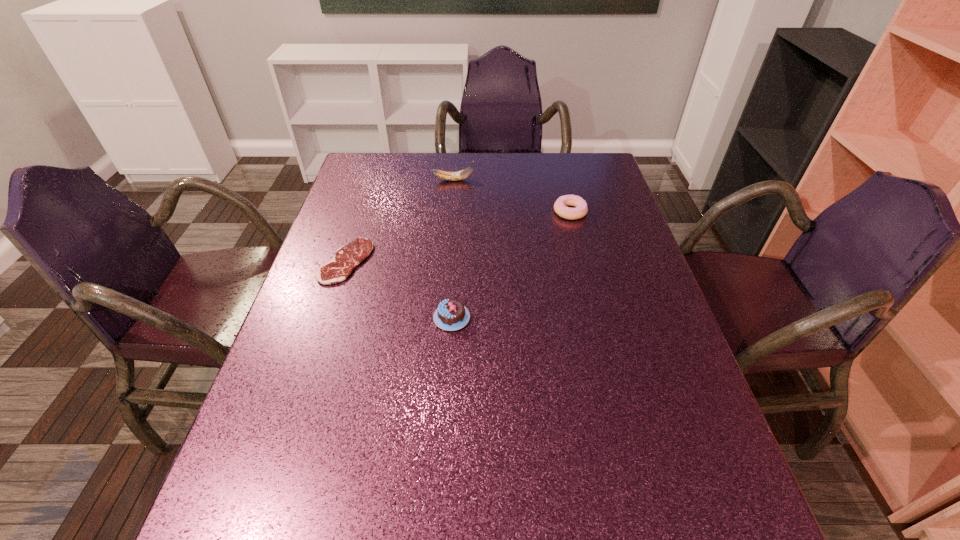
Where is `the tallest object`? the tallest object is located at coordinates (459, 175).

Locate an element on the screen. The height and width of the screenshot is (540, 960). banana is located at coordinates (459, 175).

This screenshot has width=960, height=540. I want to click on the nearest object, so click(451, 314).

Where is `the third nearest object`? This screenshot has width=960, height=540. the third nearest object is located at coordinates (560, 208).

Locate an element on the screen. The width and height of the screenshot is (960, 540). the third tallest object is located at coordinates (560, 208).

Find the location of a particular element. The image size is (960, 540). the leftmost object is located at coordinates (347, 257).

Where is `steak`? Image resolution: width=960 pixels, height=540 pixels. steak is located at coordinates (347, 257).

Locate an element on the screen. The width and height of the screenshot is (960, 540). free space located 0.370m on the peel of the tallest object is located at coordinates point(587,180).

Locate an element on the screen. vacant point located 0.090m on the left of the chocolate cake is located at coordinates (395, 318).

Locate an element on the screen. The height and width of the screenshot is (540, 960). vacant position located on the back of the doughnut is located at coordinates (559, 166).